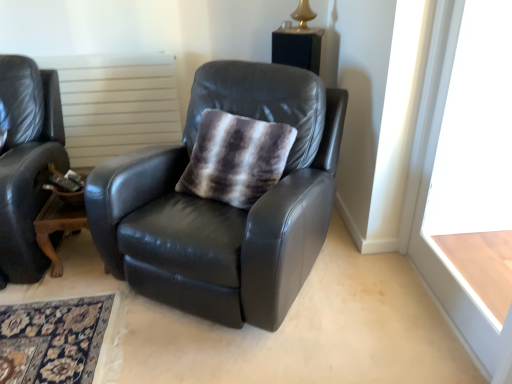
This screenshot has height=384, width=512. In order to click on brown wooden table at lower left in this screenshot , I will do `click(57, 226)`.

In order to face fuzzy brown and white throw pillow at center, should I rotate leftwards or rightwards?

Rotate left and turn 3.169 degrees.

What do you see at coordinates (224, 204) in the screenshot? I see `matte black leather chair at center` at bounding box center [224, 204].

Measure the distance between white wood window frame at right and camera.

white wood window frame at right is 5.19 feet from camera.

Locate an element on the screen. brown wooden table at lower left is located at coordinates (57, 226).

From a real-world perspective, does matte black leather chair at center stand above white wood window frame at right?

No, from a real-world perspective, matte black leather chair at center is not on top of white wood window frame at right.

Who is shorter, matte black leather chair at center or white wood window frame at right?

matte black leather chair at center is shorter.

Is matte black leather chair at center not within white wood window frame at right?

Yes.

From the image's perspective, is matte black leather chair at center above or below white wood window frame at right?

Clearly, from the image's perspective, matte black leather chair at center is above white wood window frame at right.

Looking at their sizes, would you say matte black leather chair at center is wider or thinner than fuzzy brown and white throw pillow at center?

matte black leather chair at center is wider than fuzzy brown and white throw pillow at center.

Which is more distant, (259, 115) or (281, 160)?

The point (259, 115) is farther from the camera.

The image size is (512, 384). I want to click on chair to the left of fuzzy brown and white throw pillow at center, so click(224, 204).

You are a GUI agent. You are given a task and a screenshot of the screen. Output one action in this format:
    pyautogui.click(x=<x>, y=<y>)
    Task: Click on the table below the matte black leather chair at center (from a real-world perspective)
    The width and height of the screenshot is (512, 384).
    Given the screenshot: What is the action you would take?
    pyautogui.click(x=57, y=226)

Between matte black leather chair at center and brown wooden table at lower left, which one is positioned in front?

matte black leather chair at center is in front.

Is matte black leather chair at center positioned with its back to brown wooden table at lower left?

No, matte black leather chair at center is not facing away from brown wooden table at lower left.

Which object is positioned more to the left, matte black leather chair at center or brown wooden table at lower left?

Positioned to the left is brown wooden table at lower left.

From the image's perspective, which object appears higher, fuzzy brown and white throw pillow at center or matte black leather chair at center?

fuzzy brown and white throw pillow at center, from the image's perspective.

Locate an element on the screen. This screenshot has width=512, height=384. chair below the fuzzy brown and white throw pillow at center (from the image's perspective) is located at coordinates (224, 204).

Considering the relative sizes of fuzzy brown and white throw pillow at center and matte black leather chair at center in the image provided, is fuzzy brown and white throw pillow at center shorter than matte black leather chair at center?

Yes, fuzzy brown and white throw pillow at center is shorter than matte black leather chair at center.

Considering the sizes of fuzzy brown and white throw pillow at center and matte black leather chair at center in the image, is fuzzy brown and white throw pillow at center wider or thinner than matte black leather chair at center?

Considering their sizes, fuzzy brown and white throw pillow at center looks slimmer than matte black leather chair at center.

How many degrees apart are the facing directions of brown wooden table at lower left and fuzzy brown and white throw pillow at center?

30.1 degrees.

Based on the photo, how distant is brown wooden table at lower left from fuzzy brown and white throw pillow at center?

A distance of 28.87 inches exists between brown wooden table at lower left and fuzzy brown and white throw pillow at center.

Is brown wooden table at lower left facing away from fuzzy brown and white throw pillow at center?

No, brown wooden table at lower left's orientation is not away from fuzzy brown and white throw pillow at center.

Find the location of a particular element. throw pillow above the brown wooden table at lower left (from a real-world perspective) is located at coordinates (236, 158).

Could you tell me if white wood window frame at right is facing fuzzy brown and white throw pillow at center?

Yes.

Is white wood window frame at right further to the viewer compared to fuzzy brown and white throw pillow at center?

No, it is in front of fuzzy brown and white throw pillow at center.

From a real-world perspective, does white wood window frame at right sit lower than fuzzy brown and white throw pillow at center?

Yes, from a real-world perspective, white wood window frame at right is under fuzzy brown and white throw pillow at center.

From the picture: From the image's perspective, which one is positioned higher, white wood window frame at right or fuzzy brown and white throw pillow at center?

From the image's view, fuzzy brown and white throw pillow at center is above.

Does white wood window frame at right come behind brown wooden table at lower left?

That is False.

From the image's perspective, is white wood window frame at right located beneath brown wooden table at lower left?

No, from the image's perspective, white wood window frame at right is not beneath brown wooden table at lower left.

Find the location of a particular element. The height and width of the screenshot is (384, 512). table behind the white wood window frame at right is located at coordinates (57, 226).

From a real-world perspective, relative to brown wooden table at lower left, is white wood window frame at right vertically above or below?

In terms of real-world spatial position, white wood window frame at right is above brown wooden table at lower left.

Find the location of a particular element. Image resolution: width=512 pixels, height=384 pixels. window frame that appears above the matte black leather chair at center (from a real-world perspective) is located at coordinates (477, 158).

At what (x,y) coordinates should I click in order to perform the action: click on chair lying in front of the fuzzy brown and white throw pillow at center. Please return your answer as a coordinate pair (x, y). The height and width of the screenshot is (384, 512). Looking at the image, I should click on (224, 204).

Which object lies further to the anchor point brown wooden table at lower left, matte black leather chair at center or white textured radiator at upper center?

Among the two, white textured radiator at upper center is located further to brown wooden table at lower left.

Which object lies further to the anchor point fuzzy brown and white throw pillow at center, brown wooden table at lower left or matte black leather chair at center?

Among the two, brown wooden table at lower left is located further to fuzzy brown and white throw pillow at center.

Which object lies nearer to the anchor point white wood window frame at right, fuzzy brown and white throw pillow at center or matte black leather chair at center?

matte black leather chair at center is positioned closer to the anchor white wood window frame at right.

Based on their spatial positions, is matte black leather chair at center or fuzzy brown and white throw pillow at center closer to white wood window frame at right?

matte black leather chair at center is closer to white wood window frame at right.

From the image, which object appears to be farther from white wood window frame at right, matte black leather chair at center or white textured radiator at upper center?

Among the two, white textured radiator at upper center is located further to white wood window frame at right.

Considering their positions, is white wood window frame at right positioned closer to fuzzy brown and white throw pillow at center than white textured radiator at upper center?

The object closer to fuzzy brown and white throw pillow at center is white wood window frame at right.

Estimate the real-world distances between objects in this image. Which object is closer to fuzzy brown and white throw pillow at center, matte black leather chair at center or white textured radiator at upper center?

matte black leather chair at center.

Considering their positions, is brown wooden table at lower left positioned further to fuzzy brown and white throw pillow at center than white textured radiator at upper center?

white textured radiator at upper center is positioned further to the anchor fuzzy brown and white throw pillow at center.

The height and width of the screenshot is (384, 512). Identify the location of chair situated between brown wooden table at lower left and fuzzy brown and white throw pillow at center from left to right. (224, 204).

This screenshot has width=512, height=384. Identify the location of chair situated between white textured radiator at upper center and white wood window frame at right from left to right. (224, 204).

Find the location of `table located between fuzzy brown and white throw pillow at center and white textured radiator at upper center in the depth direction`. table located between fuzzy brown and white throw pillow at center and white textured radiator at upper center in the depth direction is located at coordinates (57, 226).

Where is `throw pillow between white textured radiator at upper center and white wood window frame at right from left to right`? This screenshot has width=512, height=384. throw pillow between white textured radiator at upper center and white wood window frame at right from left to right is located at coordinates (236, 158).